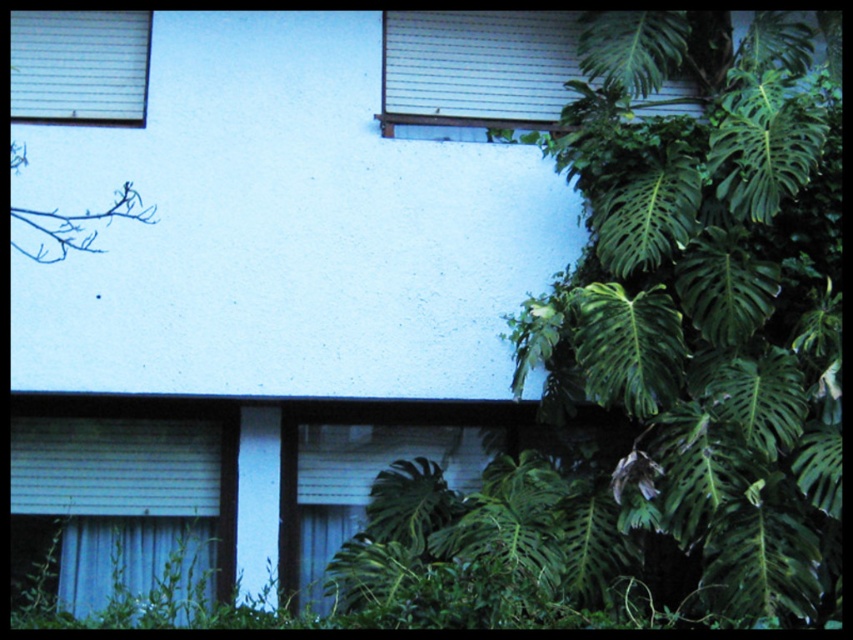
You are an architect designing a new building and want to ensure that the windows allow for maximum natural light. Based on the image, which window, the white textured window at upper center or the white matte window at upper left, would you choose for better light diffusion?

The white textured window at upper center has a greater height compared to the white matte window at upper left, making it better for light diffusion as taller windows can allow more light to enter.

You are standing in front of a building and want to take a photo of the white textured window at upper center. Based on its position coordinates, where should you aim your camera?

The white textured window at upper center is located at coordinates point (x=477, y=68), so aim your camera there.

You are standing in front of the building and want to locate the point at coordinates (79, 67). Based on the scene description, where would this point be located?

The point at coordinates (79, 67) is on the white matte window at upper left.